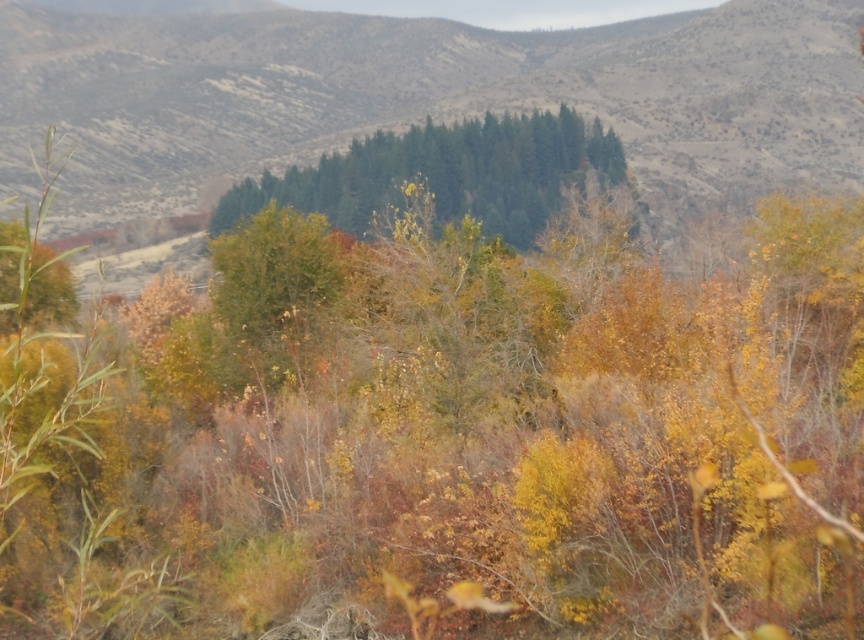
Based on the scene description, where are the green textured trees at center located in the image?

The green textured trees at center are located at point (x=418, y=96).

You are an environmental scientist studying the landscape. You observe the green textured trees at center and the green matte trees at center. Which of these two tree types is positioned higher in the image?

The green textured trees at center are positioned higher in the image than the green matte trees at center, as they are located above them.